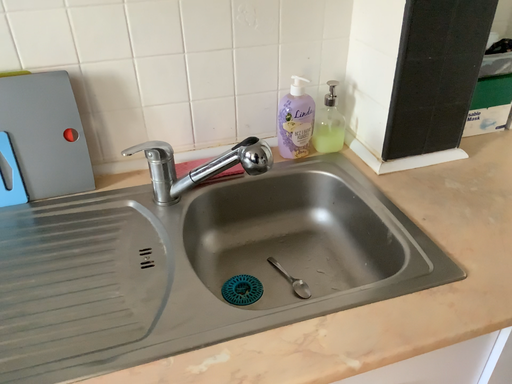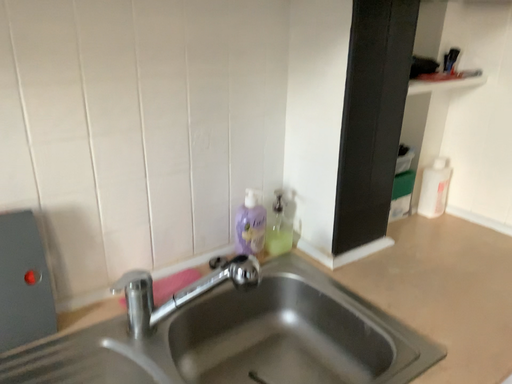
Question: Which way did the camera rotate in the video?

Choices:
 (A) rotated downward
 (B) rotated upward

Answer: (B)